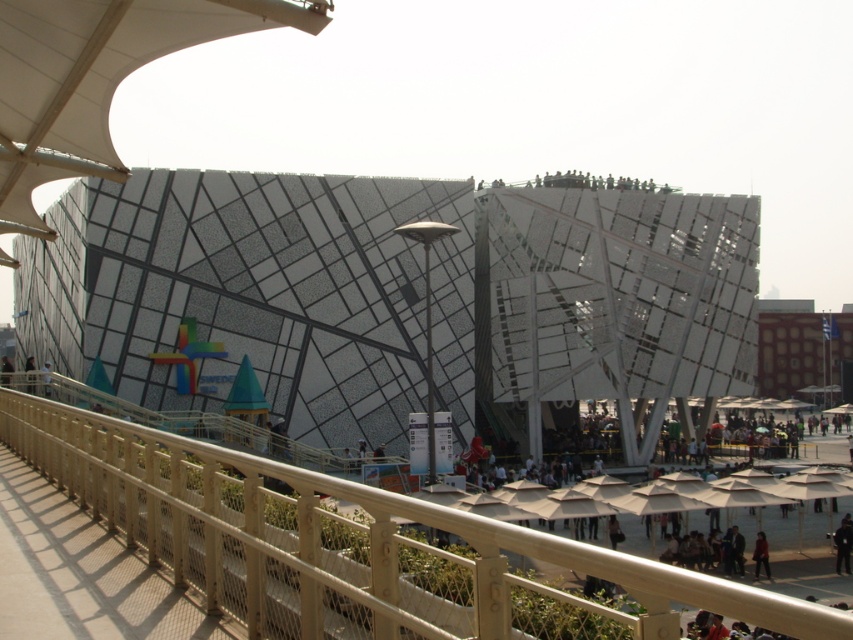
Question: Among these points, which one is nearest to the camera?

Choices:
 (A) (363, 451)
 (B) (764, 570)

Answer: (B)

Question: Which of the following is the farthest from the observer?

Choices:
 (A) (32, 362)
 (B) (364, 448)
 (C) (486, 529)

Answer: (A)

Question: Does dark red fabric at lower right come in front of dark brown leather jacket at upper left?

Choices:
 (A) yes
 (B) no

Answer: (A)

Question: Is white geometric structure at center to the left of dark brown leather jacket at upper left from the viewer's perspective?

Choices:
 (A) yes
 (B) no

Answer: (B)

Question: Is dark red fabric at lower right bigger than dark brown leather jacket at upper left?

Choices:
 (A) no
 (B) yes

Answer: (A)

Question: Considering the real-world distances, which object is farthest from the dark gray fabric jacket at upper center?

Choices:
 (A) wooden at center
 (B) white geometric structure at center
 (C) dark red fabric at lower right

Answer: (C)